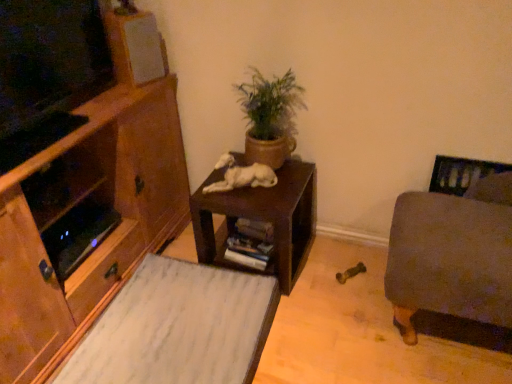
The image size is (512, 384). In order to click on free location to the left of velvet gray ottoman at right in this screenshot , I will do `click(334, 316)`.